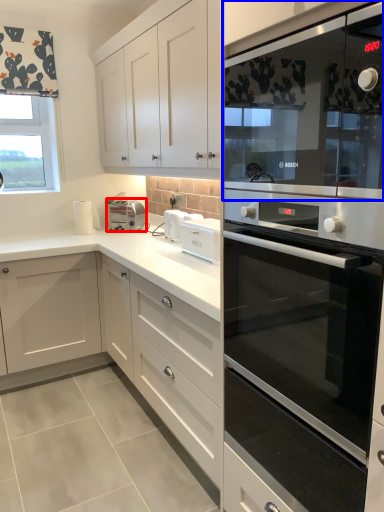
Question: Which of the following is the closest to the observer, appliance (highlighted by a red box) or microwave oven (highlighted by a blue box)?

Choices:
 (A) appliance
 (B) microwave oven

Answer: (B)